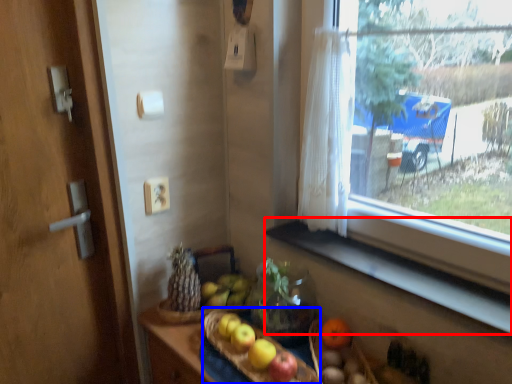
Question: Which point is closer to the camera, window sill (highlighted by a red box) or basket (highlighted by a blue box)?

Choices:
 (A) window sill
 (B) basket

Answer: (A)